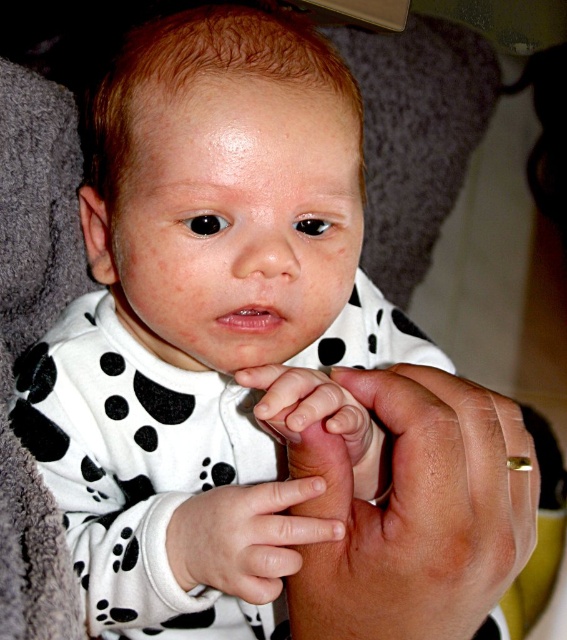
Question: From the image, what is the correct spatial relationship of smooth skin hand at center in relation to white smooth skin at center?

Choices:
 (A) above
 (B) below

Answer: (A)

Question: Can you confirm if smooth skin hand at center is positioned below white smooth skin at center?

Choices:
 (A) no
 (B) yes

Answer: (A)

Question: Among these objects, which one is farthest from the camera?

Choices:
 (A) white smooth skin at center
 (B) smooth skin hand at center

Answer: (A)

Question: Which object appears farthest from the camera in this image?

Choices:
 (A) smooth skin hand at center
 (B) white smooth skin at center

Answer: (B)

Question: Which point is farther to the camera?

Choices:
 (A) pyautogui.click(x=273, y=548)
 (B) pyautogui.click(x=391, y=380)

Answer: (B)

Question: In this image, where is smooth skin hand at center located relative to white smooth skin at center?

Choices:
 (A) left
 (B) right

Answer: (B)